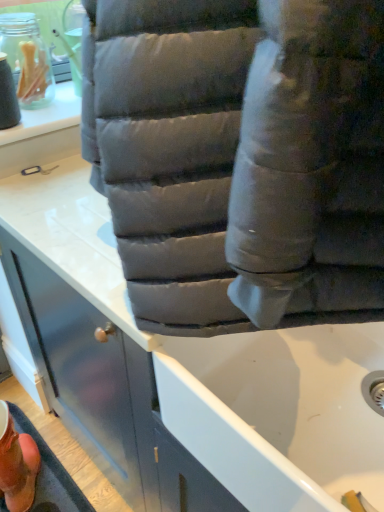
Question: Is matte gray cushion at lower center facing away from orange suede boot at lower left?

Choices:
 (A) yes
 (B) no

Answer: (B)

Question: Is matte gray cushion at lower center thinner than orange suede boot at lower left?

Choices:
 (A) yes
 (B) no

Answer: (A)

Question: Is matte gray cushion at lower center positioned beyond the bounds of orange suede boot at lower left?

Choices:
 (A) yes
 (B) no

Answer: (A)

Question: Is matte gray cushion at lower center beside orange suede boot at lower left?

Choices:
 (A) no
 (B) yes

Answer: (A)

Question: From the image's perspective, is matte gray cushion at lower center beneath orange suede boot at lower left?

Choices:
 (A) no
 (B) yes

Answer: (A)

Question: Is matte gray cushion at lower center surrounding orange suede boot at lower left?

Choices:
 (A) yes
 (B) no

Answer: (B)

Question: Is the position of orange suede boot at lower left less distant than that of matte gray cushion at lower center?

Choices:
 (A) no
 (B) yes

Answer: (A)

Question: From the image's perspective, is orange suede boot at lower left located above matte gray cushion at lower center?

Choices:
 (A) yes
 (B) no

Answer: (B)

Question: Does orange suede boot at lower left come behind matte gray cushion at lower center?

Choices:
 (A) no
 (B) yes

Answer: (B)

Question: Would you say orange suede boot at lower left is outside matte gray cushion at lower center?

Choices:
 (A) no
 (B) yes

Answer: (B)

Question: Can you confirm if orange suede boot at lower left is smaller than matte gray cushion at lower center?

Choices:
 (A) no
 (B) yes

Answer: (B)

Question: Does orange suede boot at lower left have a greater width compared to matte gray cushion at lower center?

Choices:
 (A) yes
 (B) no

Answer: (A)

Question: From the image's perspective, is orange suede boot at lower left located above or below matte gray cushion at lower center?

Choices:
 (A) below
 (B) above

Answer: (A)